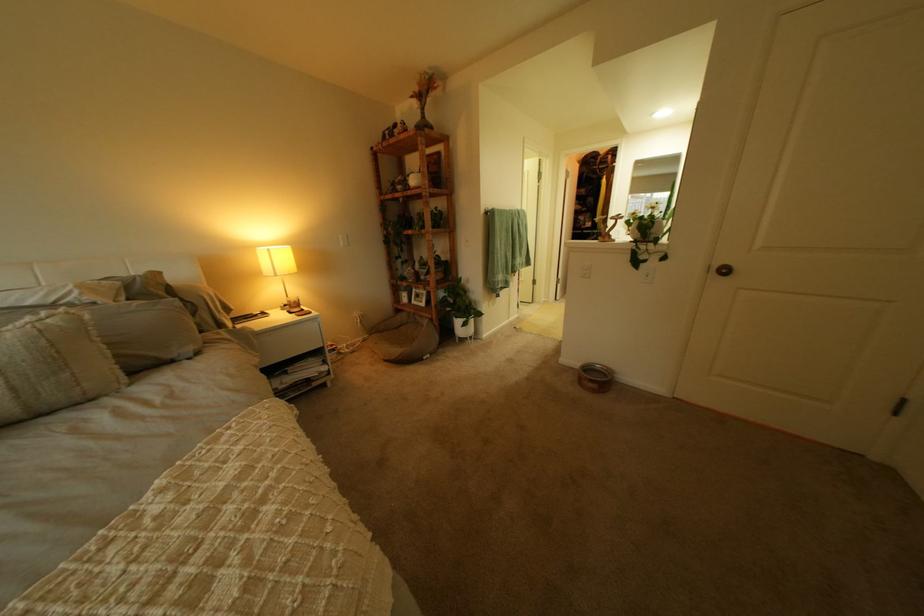
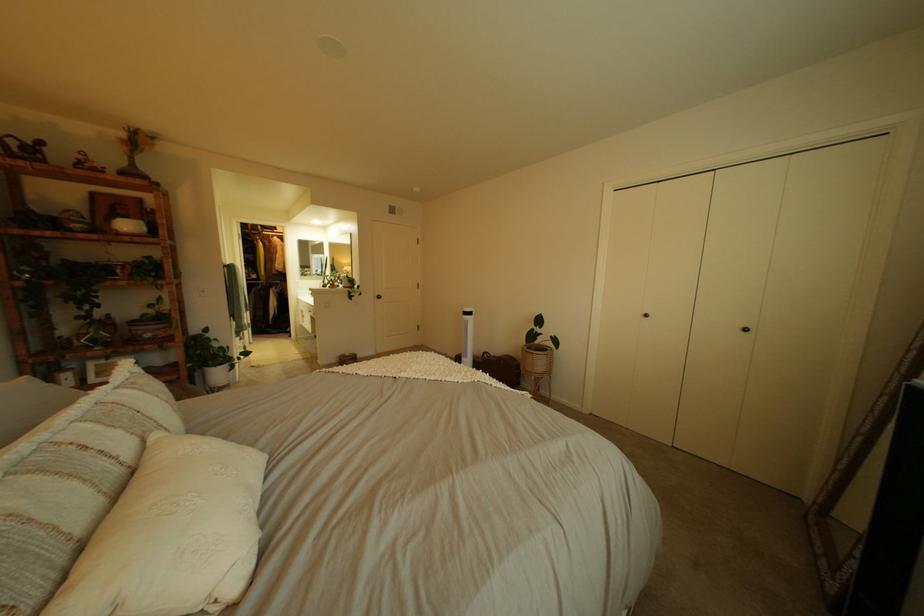
Locate, in the second image, the point that corresponds to the point at 625,158 in the first image.

(274, 228)